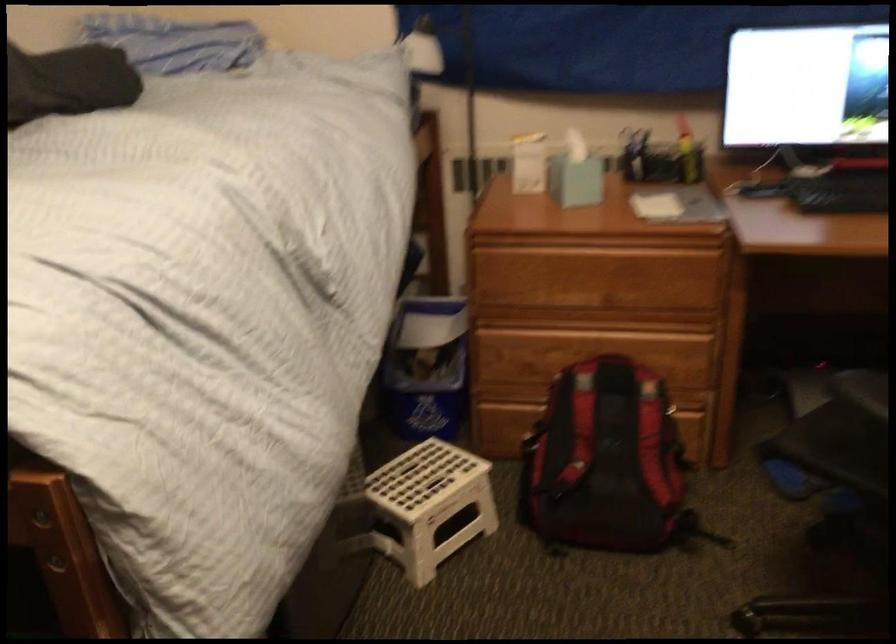
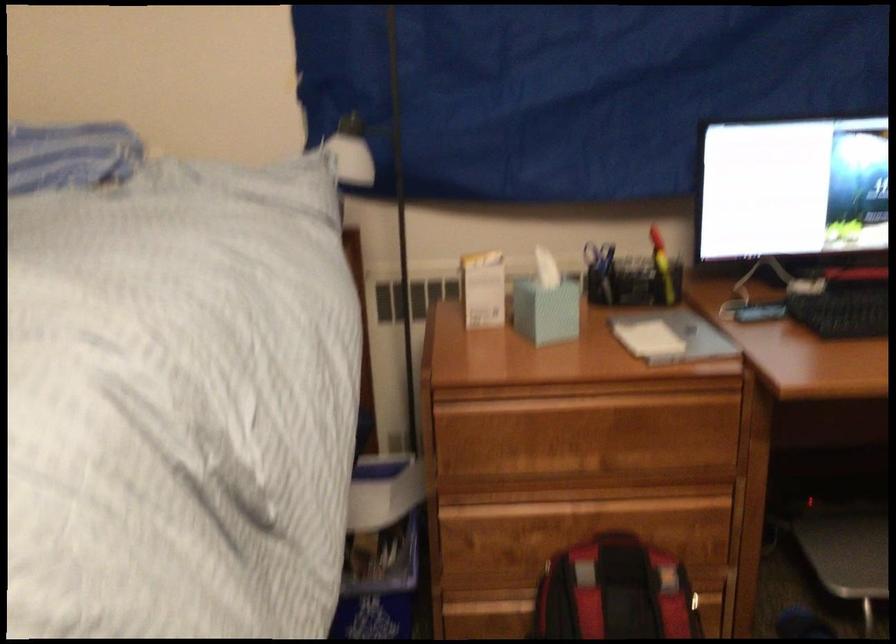
Where in the second image is the point corresponding to point 576,180 from the first image?

(546, 310)